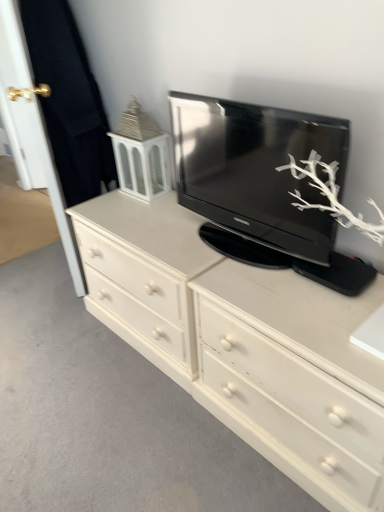
The width and height of the screenshot is (384, 512). I want to click on free space above white painted wood chest of drawers at center (from a real-world perspective), so click(106, 397).